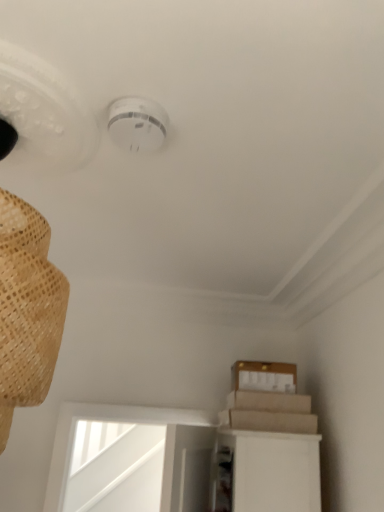
Question: From a real-world perspective, is brown cardboard at upper right on white plastic smoke detector at upper center?

Choices:
 (A) no
 (B) yes

Answer: (A)

Question: Considering the relative positions of brown cardboard at upper right and white plastic smoke detector at upper center in the image provided, is brown cardboard at upper right to the left of white plastic smoke detector at upper center from the viewer's perspective?

Choices:
 (A) no
 (B) yes

Answer: (A)

Question: Is brown cardboard at upper right far from white plastic smoke detector at upper center?

Choices:
 (A) no
 (B) yes

Answer: (B)

Question: Does brown cardboard at upper right come behind white plastic smoke detector at upper center?

Choices:
 (A) yes
 (B) no

Answer: (A)

Question: Does brown cardboard at upper right have a smaller size compared to white plastic smoke detector at upper center?

Choices:
 (A) yes
 (B) no

Answer: (B)

Question: Is brown cardboard at upper right directly adjacent to white plastic smoke detector at upper center?

Choices:
 (A) yes
 (B) no

Answer: (B)

Question: Can you confirm if white plastic smoke detector at upper center is thinner than brown cardboard at upper right?

Choices:
 (A) yes
 (B) no

Answer: (A)

Question: Can you confirm if white plastic smoke detector at upper center is taller than brown cardboard at upper right?

Choices:
 (A) no
 (B) yes

Answer: (A)

Question: Is the position of white plastic smoke detector at upper center less distant than that of brown cardboard at upper right?

Choices:
 (A) no
 (B) yes

Answer: (B)

Question: From the image's perspective, is white plastic smoke detector at upper center located beneath brown cardboard at upper right?

Choices:
 (A) no
 (B) yes

Answer: (A)

Question: Is white plastic smoke detector at upper center directly adjacent to brown cardboard at upper right?

Choices:
 (A) yes
 (B) no

Answer: (B)

Question: From a real-world perspective, is white plastic smoke detector at upper center over brown cardboard at upper right?

Choices:
 (A) no
 (B) yes

Answer: (B)

Question: From the image's perspective, relative to brown cardboard at upper right, is white plastic smoke detector at upper center above or below?

Choices:
 (A) below
 (B) above

Answer: (B)